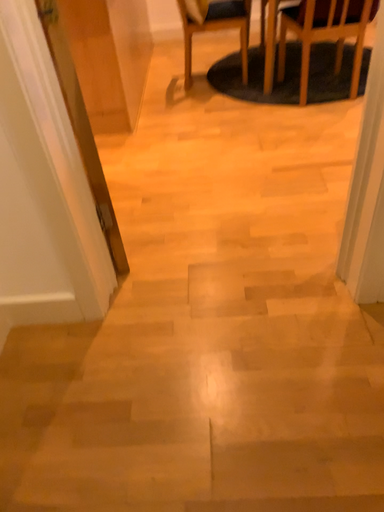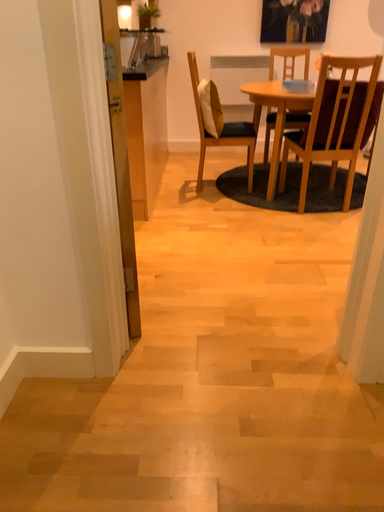
Question: How did the camera likely rotate when shooting the video?

Choices:
 (A) rotated downward
 (B) rotated upward

Answer: (B)